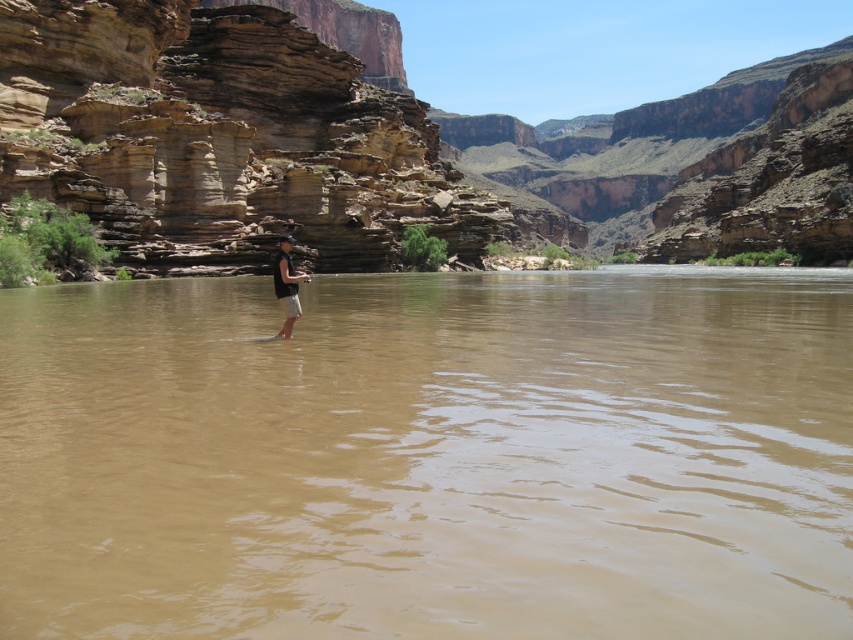
Looking at this image, who is higher up, brown muddy water at center or dark gray fabric shirt at center?

dark gray fabric shirt at center is higher up.

From the picture: Which is below, brown muddy water at center or dark gray fabric shirt at center?

brown muddy water at center is lower down.

Measure the distance between brown muddy water at center and camera.

brown muddy water at center and camera are 91.05 feet apart.

Where is `brown muddy water at center`? Image resolution: width=853 pixels, height=640 pixels. brown muddy water at center is located at coordinates [430, 456].

Who is taller, brown muddy water at center or brown rock canyon at center?

With more height is brown rock canyon at center.

Is brown muddy water at center positioned at the back of brown rock canyon at center?

No, brown muddy water at center is in front of brown rock canyon at center.

Image resolution: width=853 pixels, height=640 pixels. What do you see at coordinates (430, 456) in the screenshot? I see `brown muddy water at center` at bounding box center [430, 456].

The image size is (853, 640). In order to click on brown muddy water at center in this screenshot , I will do `click(430, 456)`.

Is brown rock canyon at center bigger than dark gray fabric shirt at center?

Yes.

Does brown rock canyon at center appear on the right side of dark gray fabric shirt at center?

Correct, you'll find brown rock canyon at center to the right of dark gray fabric shirt at center.

Between point (253, 253) and point (279, 253), which one is positioned behind?

Point (253, 253)

Locate an element on the screen. Image resolution: width=853 pixels, height=640 pixels. brown rock canyon at center is located at coordinates (386, 144).